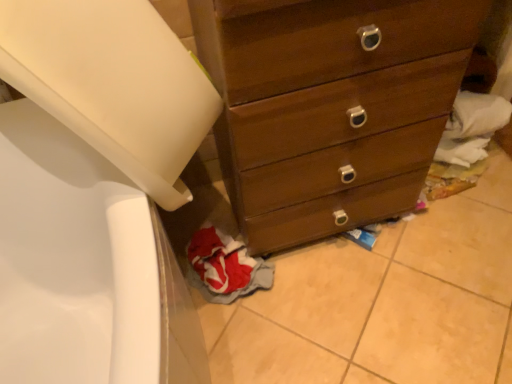
Describe the element at coordinates (329, 106) in the screenshot. I see `wooden chest of drawers at center` at that location.

Locate an element on the screen. Image resolution: width=512 pixels, height=384 pixels. wooden chest of drawers at center is located at coordinates (329, 106).

Where is `red fabric clothes at lower left`? This screenshot has width=512, height=384. red fabric clothes at lower left is located at coordinates point(225,266).

Image resolution: width=512 pixels, height=384 pixels. Describe the element at coordinates (225, 266) in the screenshot. I see `red fabric clothes at lower left` at that location.

Where is `wooden chest of drawers at center`? wooden chest of drawers at center is located at coordinates (329, 106).

Consider the image. Would you say red fabric clothes at lower left is to the left or to the right of wooden chest of drawers at center in the picture?

red fabric clothes at lower left is positioned on wooden chest of drawers at center's left side.

Does red fabric clothes at lower left come behind wooden chest of drawers at center?

Yes, red fabric clothes at lower left is further from the camera.

Which is in front, point (187, 248) or point (259, 175)?

The point (259, 175) is closer.

From the image's perspective, who appears lower, red fabric clothes at lower left or wooden chest of drawers at center?

red fabric clothes at lower left, from the image's perspective.

From a real-world perspective, is red fabric clothes at lower left physically above wooden chest of drawers at center?

Incorrect, from a real-world perspective, red fabric clothes at lower left is lower than wooden chest of drawers at center.

Does red fabric clothes at lower left have a lesser width compared to wooden chest of drawers at center?

Yes, red fabric clothes at lower left is thinner than wooden chest of drawers at center.

Is red fabric clothes at lower left taller than wooden chest of drawers at center?

No, red fabric clothes at lower left is not taller than wooden chest of drawers at center.

Based on the photo, is red fabric clothes at lower left bigger than wooden chest of drawers at center?

No, red fabric clothes at lower left is not bigger than wooden chest of drawers at center.

Does red fabric clothes at lower left contain wooden chest of drawers at center?

No, wooden chest of drawers at center is not a part of red fabric clothes at lower left.

Is red fabric clothes at lower left far from wooden chest of drawers at center?

No, red fabric clothes at lower left is not far away from wooden chest of drawers at center.

Is red fabric clothes at lower left facing towards wooden chest of drawers at center?

No, red fabric clothes at lower left is not turned towards wooden chest of drawers at center.

Measure the distance from red fabric clothes at lower left to wooden chest of drawers at center.

red fabric clothes at lower left is 15.10 inches from wooden chest of drawers at center.

Find the location of `chest of drawers to the right of red fabric clothes at lower left`. chest of drawers to the right of red fabric clothes at lower left is located at coordinates [329, 106].

Considering the positions of objects wooden chest of drawers at center and red fabric clothes at lower left in the image provided, who is more to the left, wooden chest of drawers at center or red fabric clothes at lower left?

From the viewer's perspective, red fabric clothes at lower left appears more on the left side.

In the image, is wooden chest of drawers at center positioned in front of or behind red fabric clothes at lower left?

In the image, wooden chest of drawers at center appears in front of red fabric clothes at lower left.

Which point is more forward, (x=370, y=134) or (x=222, y=279)?

The point (x=370, y=134) is closer.

From the image's perspective, is wooden chest of drawers at center beneath red fabric clothes at lower left?

No, from the image's perspective, wooden chest of drawers at center is not beneath red fabric clothes at lower left.

From a real-world perspective, who is located higher, wooden chest of drawers at center or red fabric clothes at lower left?

In real-world perspective, wooden chest of drawers at center is above.

Which of these two, wooden chest of drawers at center or red fabric clothes at lower left, is thinner?

With smaller width is red fabric clothes at lower left.

Looking at this image, considering the sizes of objects wooden chest of drawers at center and red fabric clothes at lower left in the image provided, who is taller, wooden chest of drawers at center or red fabric clothes at lower left?

With more height is wooden chest of drawers at center.

Who is smaller, wooden chest of drawers at center or red fabric clothes at lower left?

red fabric clothes at lower left.

Would you say wooden chest of drawers at center is outside red fabric clothes at lower left?

Indeed, wooden chest of drawers at center is completely outside red fabric clothes at lower left.

Are wooden chest of drawers at center and red fabric clothes at lower left located far from each other?

No, wooden chest of drawers at center is in close proximity to red fabric clothes at lower left.

In the scene shown: Is wooden chest of drawers at center turned away from red fabric clothes at lower left?

wooden chest of drawers at center is not turned away from red fabric clothes at lower left.

Locate an element on the screen. The image size is (512, 384). chest of drawers in front of the red fabric clothes at lower left is located at coordinates (329, 106).

At what (x,y) coordinates should I click in order to perform the action: click on the chest of drawers in front of the red fabric clothes at lower left. Please return your answer as a coordinate pair (x, y). This screenshot has width=512, height=384. Looking at the image, I should click on (329, 106).

This screenshot has width=512, height=384. Find the location of `material behind the wooden chest of drawers at center`. material behind the wooden chest of drawers at center is located at coordinates (225, 266).